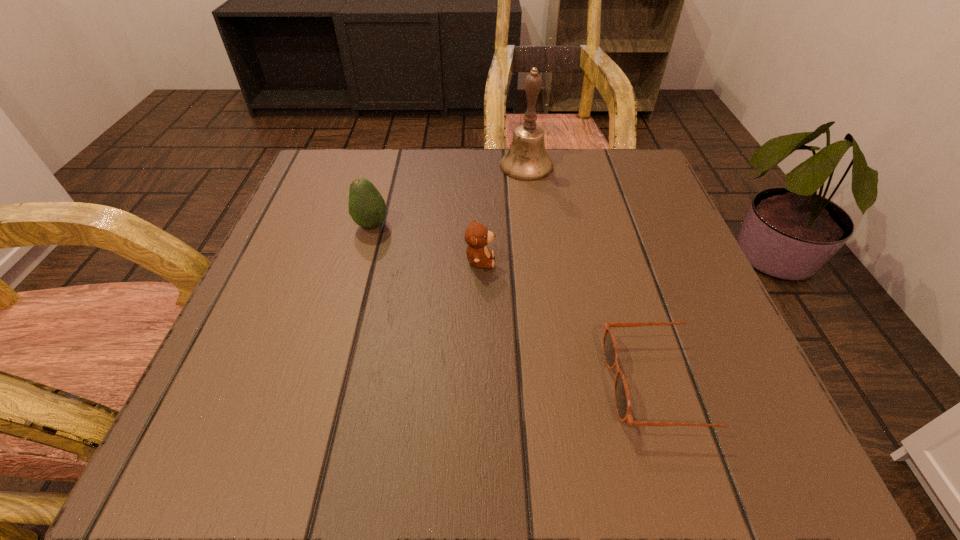
In the image, there is a desktop. In order to click on free space at the near edge in this screenshot , I will do `click(451, 440)`.

Where is `vacant area at the left edge`? vacant area at the left edge is located at coordinates (288, 232).

Locate an element on the screen. vacant space at the right edge of the desktop is located at coordinates (688, 286).

In the image, there is a desktop. At what (x,y) coordinates should I click in order to perform the action: click on free space at the far left corner. Please return your answer as a coordinate pair (x, y). The width and height of the screenshot is (960, 540). Looking at the image, I should click on (340, 186).

In the image, there is a desktop. Identify the location of vacant space at the far right corner. This screenshot has width=960, height=540. (631, 176).

In order to click on vacant space at the near right corner of the desktop in this screenshot , I will do `click(723, 430)`.

Identify the location of unoccupied area between the second object from right to left and the third farthest object. (503, 213).

Where is `free space between the rightmost object and the avocado`? Image resolution: width=960 pixels, height=540 pixels. free space between the rightmost object and the avocado is located at coordinates (518, 305).

I want to click on vacant region between the third shortest object and the farthest object, so click(448, 195).

This screenshot has width=960, height=540. Find the location of `vacant space in between the nearest object and the tallest object`. vacant space in between the nearest object and the tallest object is located at coordinates (596, 275).